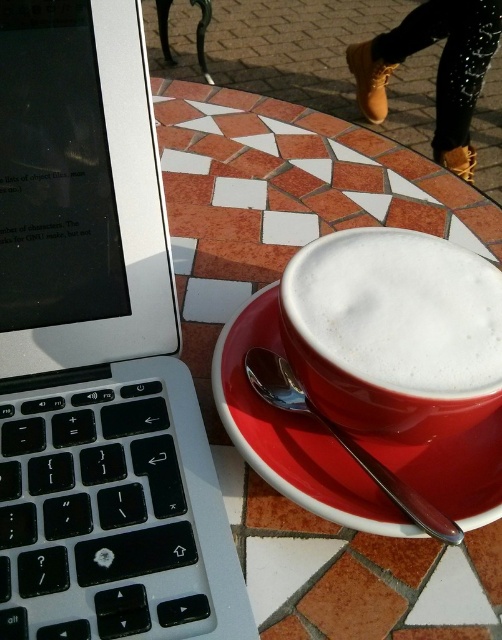
Question: Which point is farther to the camera?

Choices:
 (A) silver metallic laptop at left
 (B) red ceramic saucer at center

Answer: (B)

Question: Which of the following is the farthest from the observer?

Choices:
 (A) red ceramic saucer at center
 (B) silver metallic laptop at left
 (C) white frothy foam at center

Answer: (A)

Question: Which of the following is the closest to the observer?

Choices:
 (A) (121, 248)
 (B) (406, 364)

Answer: (B)

Question: Can you confirm if silver metallic laptop at left is positioned to the right of white frothy foam at center?

Choices:
 (A) yes
 (B) no

Answer: (B)

Question: Can you confirm if silver metallic laptop at left is thinner than white frothy foam at center?

Choices:
 (A) no
 (B) yes

Answer: (A)

Question: Is silver metallic laptop at left to the right of white frothy foam at center from the viewer's perspective?

Choices:
 (A) yes
 (B) no

Answer: (B)